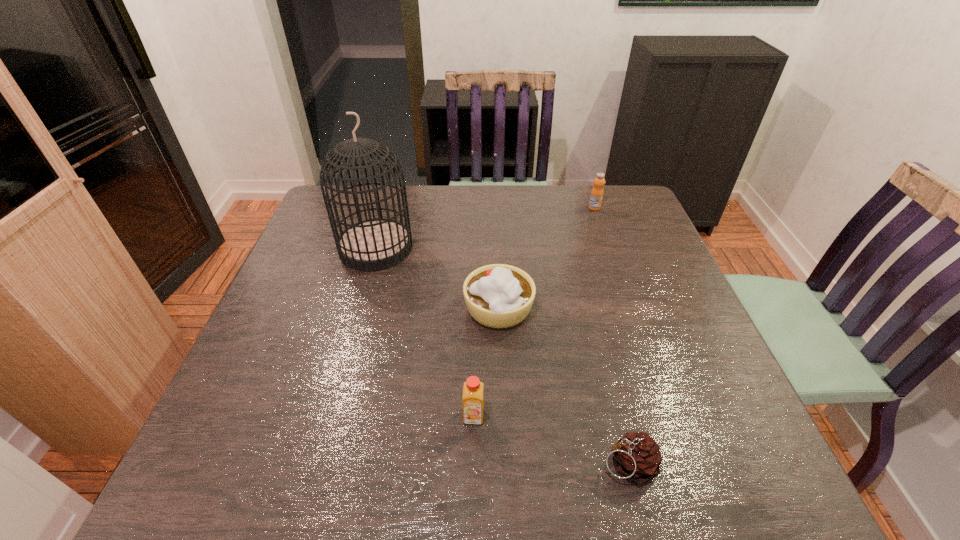
Locate an element on the screen. Image resolution: width=960 pixels, height=540 pixels. blank area located 0.110m on the right of the third nearest object is located at coordinates (579, 308).

Locate an element on the screen. The image size is (960, 540). vacant area located 0.350m on the front label of the farthest object is located at coordinates (622, 288).

You are a GUI agent. You are given a task and a screenshot of the screen. Output one action in this format:
    pyautogui.click(x=<x>, y=<y>)
    Task: Click on the free space located on the front and back of the nearer orange juice
    This screenshot has height=540, width=960.
    Given the screenshot: What is the action you would take?
    pyautogui.click(x=473, y=468)

Image resolution: width=960 pixels, height=540 pixels. I want to click on vacant position located 0.300m with a leaf charm attached to the nearest object, so click(x=431, y=464).

Identify the location of vacant space situated 0.080m with a leaf charm attached to the nearest object. Image resolution: width=960 pixels, height=540 pixels. (555, 464).

The height and width of the screenshot is (540, 960). I want to click on vacant point located with a leaf charm attached to the nearest object, so click(x=420, y=464).

Find the location of a particular element. birdcage present at the far edge is located at coordinates (376, 244).

Where is `orange juice that is at the far edge`? The width and height of the screenshot is (960, 540). orange juice that is at the far edge is located at coordinates (596, 196).

Locate an element on the screen. This screenshot has width=960, height=540. object that is positioned at the near edge is located at coordinates (637, 457).

Locate an element on the screen. object located at the left edge is located at coordinates (376, 244).